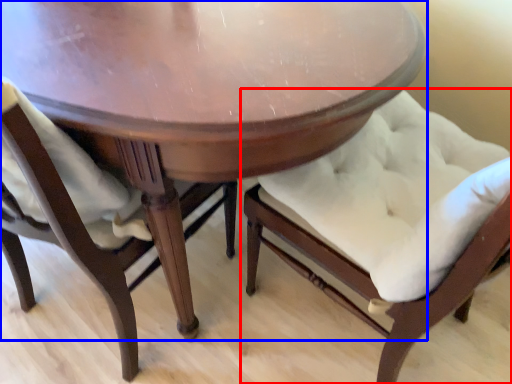
Question: Which object appears closest to the camera in this image, chair (highlighted by a red box) or table (highlighted by a blue box)?

Choices:
 (A) chair
 (B) table

Answer: (A)